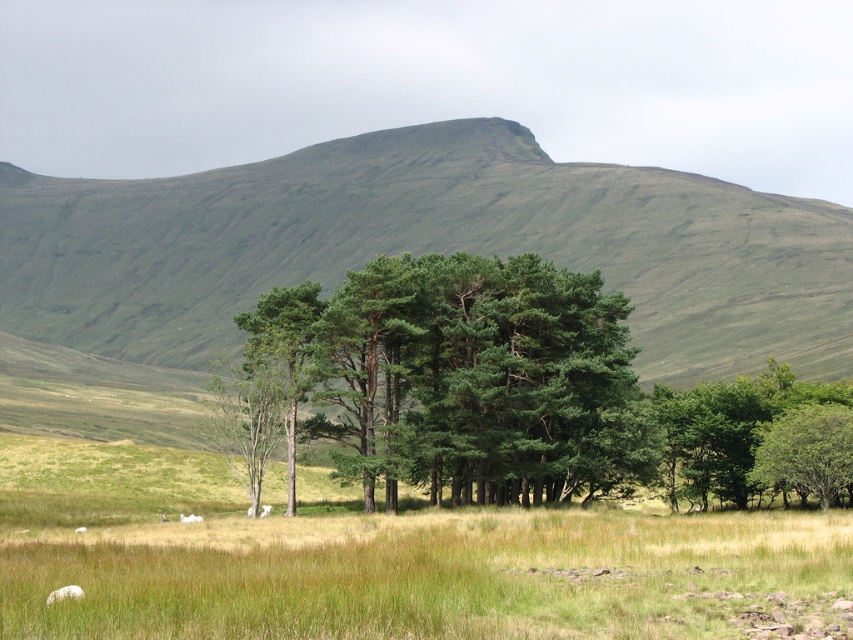
This screenshot has width=853, height=640. I want to click on green matte trees at center, so click(x=466, y=374).

Who is positioned more to the right, green matte trees at center or green leafy trees at right?

green leafy trees at right

Between point (283, 304) and point (730, 499), which one is positioned behind?

Point (730, 499)

This screenshot has height=640, width=853. In order to click on green matte trees at center in this screenshot , I will do `click(466, 374)`.

Is green grassy hill at center to the left of green matte trees at center from the viewer's perspective?

Indeed, green grassy hill at center is positioned on the left side of green matte trees at center.

Is point (634, 236) positioned behind point (595, 477)?

Yes, point (634, 236) is behind point (595, 477).

What are the coordinates of `green grassy hill at center` in the screenshot? It's located at (426, 246).

Does green matte trees at center come in front of white woolly sheep at lower left?

No, green matte trees at center is behind white woolly sheep at lower left.

Between point (521, 449) and point (51, 600), which one is positioned behind?

The point (521, 449) is more distant.

Find the location of `green matte trees at center`. green matte trees at center is located at coordinates (466, 374).